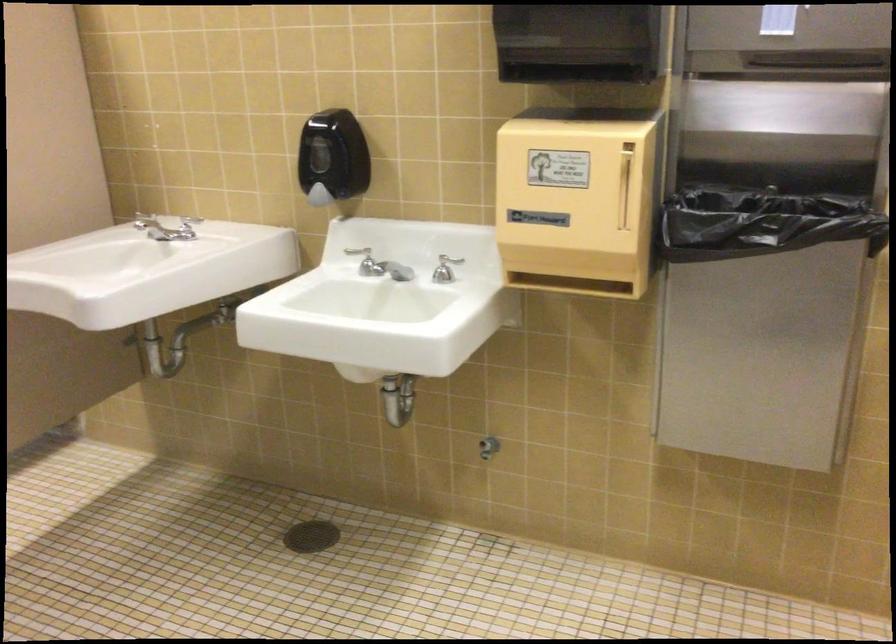
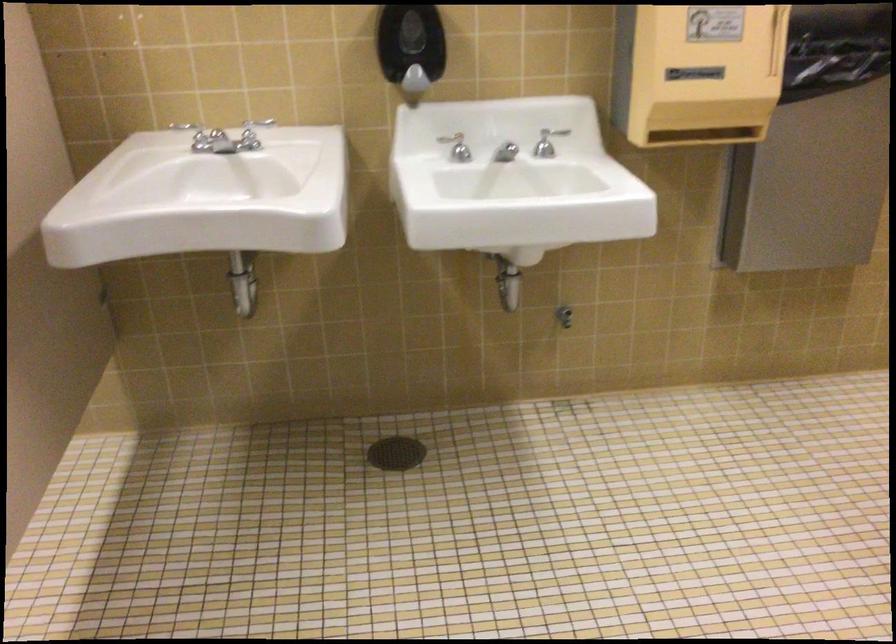
In the second image, find the point that corresponds to (x=375, y=263) in the first image.

(457, 147)